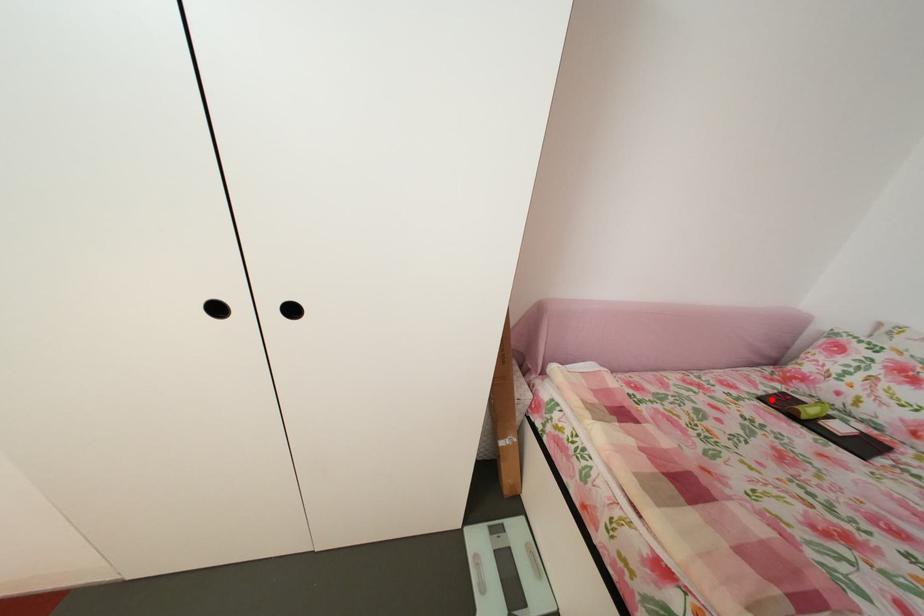
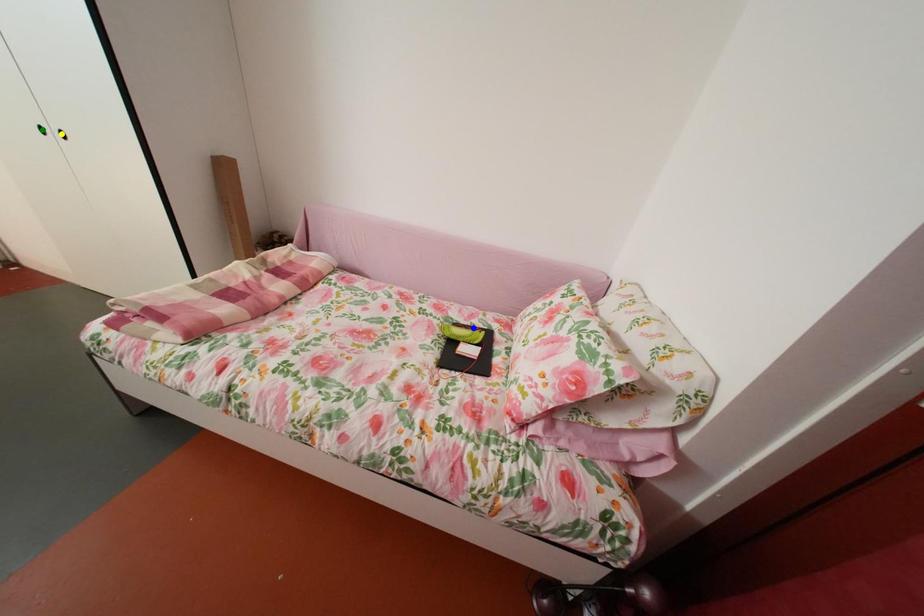
Question: I am providing you with two images of the same scene from different viewpoints. A red point is marked on the first image. You are given multiple points on the second image. Which point in image 2 is actually the same real-world point as the red point in image 1?

Choices:
 (A) blue point
 (B) green point
 (C) yellow point

Answer: (A)